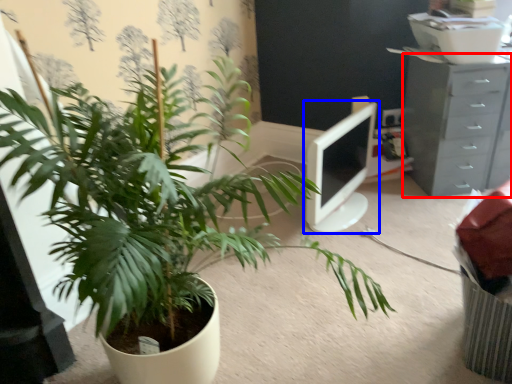
Question: Which object appears closest to the camera in this image, chest of drawers (highlighted by a red box) or computer monitor (highlighted by a blue box)?

Choices:
 (A) chest of drawers
 (B) computer monitor

Answer: (B)